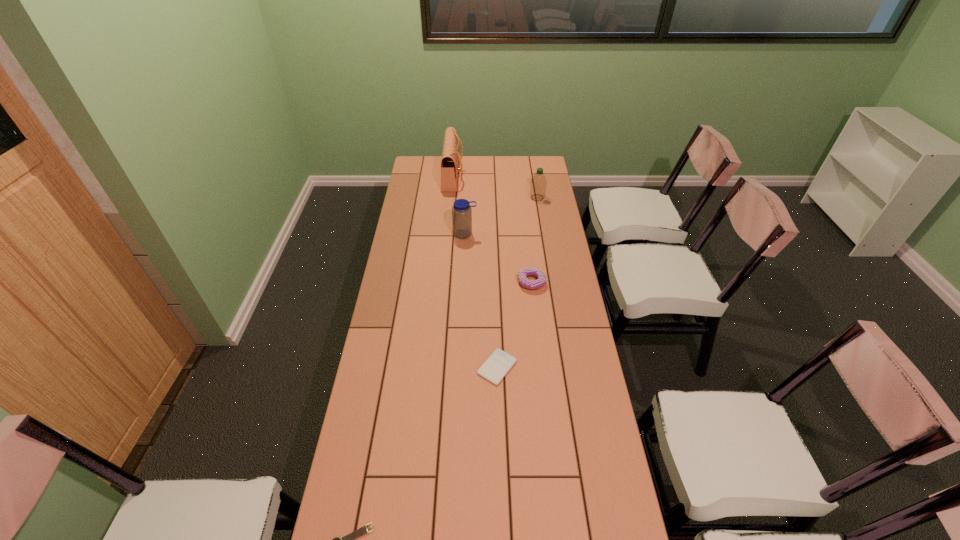
At what (x,y) coordinates should I click in order to perform the action: click on vacant area that lies between the second farthest object and the fifth farthest object. Please return your answer as a coordinate pair (x, y). The image size is (960, 540). Looking at the image, I should click on (517, 282).

Where is `vacant space that's between the third nearest object and the farther water bottle`? vacant space that's between the third nearest object and the farther water bottle is located at coordinates [535, 240].

Where is `vacant area that lies between the fifth tallest object and the farther water bottle`? vacant area that lies between the fifth tallest object and the farther water bottle is located at coordinates (517, 282).

Locate an element on the screen. The height and width of the screenshot is (540, 960). free space between the fourth farthest object and the tallest object is located at coordinates (492, 229).

This screenshot has width=960, height=540. I want to click on vacant area between the fifth farthest object and the tallest object, so click(475, 271).

Find the location of a particular element. empty location between the farther water bottle and the handbag is located at coordinates (495, 187).

Select which object is the closest to the third nearest object. Please provide its 2D coordinates. Your answer should be formatted as a tuple, i.e. [(x, y)], where the tuple contains the x and y coordinates of a point satisfying the conditions above.

[(461, 211)]

Identify which object is located as the third nearest to the left water bottle. Please provide its 2D coordinates. Your answer should be formatted as a tuple, i.e. [(x, y)], where the tuple contains the x and y coordinates of a point satisfying the conditions above.

[(538, 183)]

This screenshot has width=960, height=540. I want to click on free location that satisfies the following two spatial constraints: 1. on the back side of the third shortest object; 2. on the front-facing side of the handbag, so click(x=518, y=176).

Find the location of `vacant space that satisfies the following two spatial constraints: 1. with a carrying loop on the side of the third shortest object; 2. on the right side of the fourth nearest object`. vacant space that satisfies the following two spatial constraints: 1. with a carrying loop on the side of the third shortest object; 2. on the right side of the fourth nearest object is located at coordinates (463, 282).